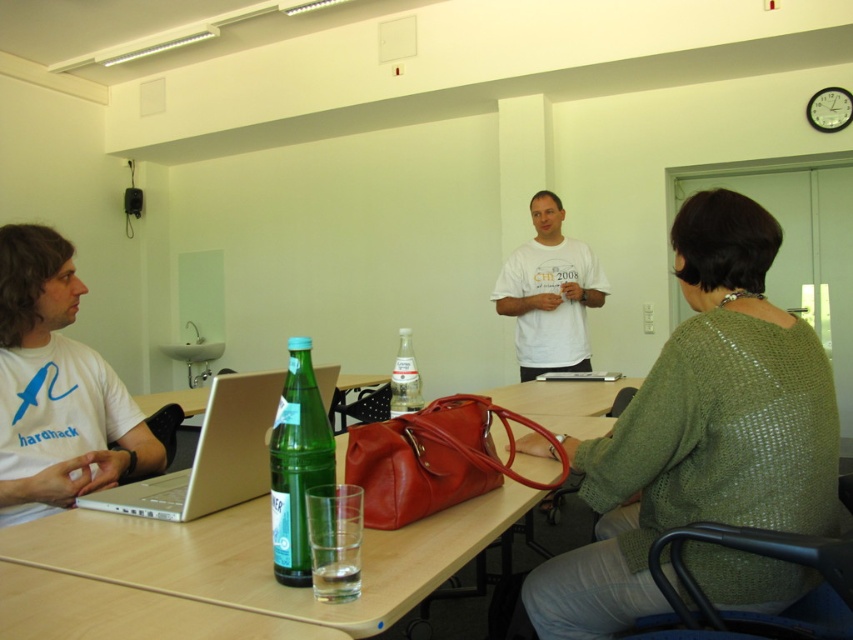
Question: Which object appears farthest from the camera in this image?

Choices:
 (A) white cotton t-shirt at center
 (B) clear glass bottle at center
 (C) white matte t-shirt at left
 (D) green knitted sweater at center

Answer: (A)

Question: Is white cotton t-shirt at center below green glass bottle at center?

Choices:
 (A) no
 (B) yes

Answer: (A)

Question: Does silver metallic laptop at left come behind white cotton t-shirt at center?

Choices:
 (A) yes
 (B) no

Answer: (B)

Question: Which of the following is the closest to the observer?

Choices:
 (A) click(254, 570)
 (B) click(639, 468)
 (C) click(258, 381)
 (D) click(402, 337)

Answer: (A)

Question: Estimate the real-world distances between objects in this image. Which object is closer to the silver metallic laptop at left?

Choices:
 (A) green knitted sweater at center
 (B) wooden table at center
 (C) green glass bottle at center
 (D) clear glass bottle at center

Answer: (C)

Question: Is wooden table at center closer to the viewer compared to green glass bottle at center?

Choices:
 (A) no
 (B) yes

Answer: (B)